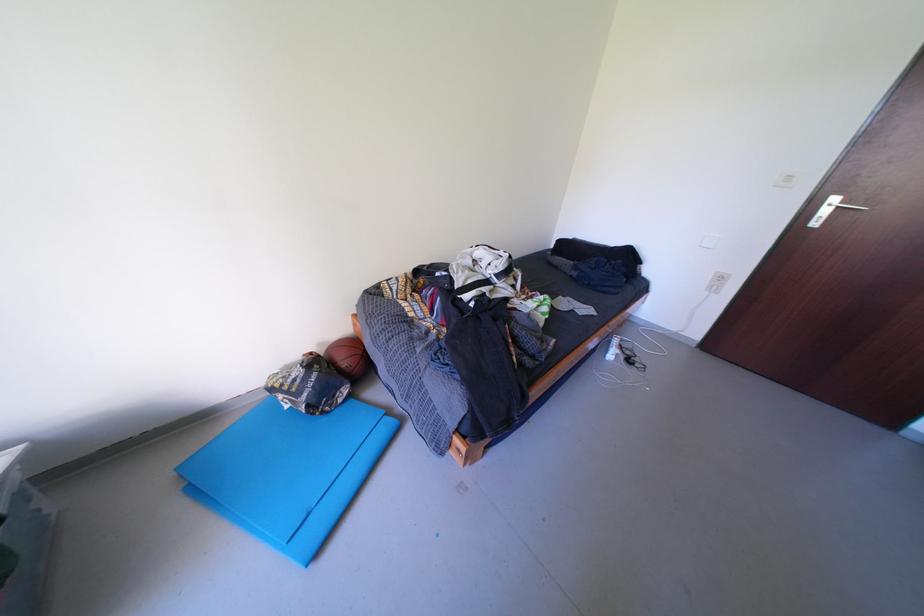
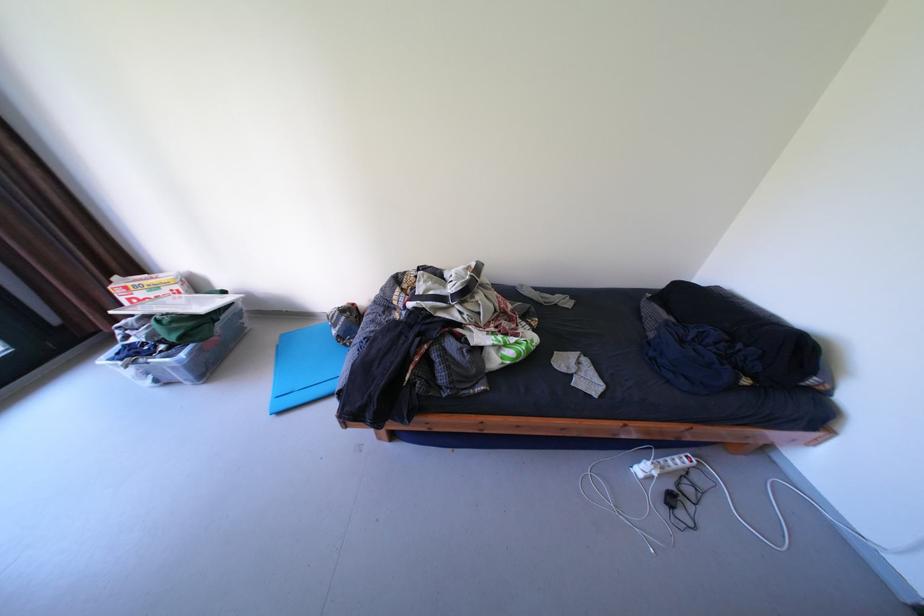
Question: The camera is either moving clockwise (left) or counter-clockwise (right) around the object. The first image is from the beginning of the video and the second image is from the end. Is the camera moving left or right when shooting the video?

Choices:
 (A) Left
 (B) Right

Answer: (B)